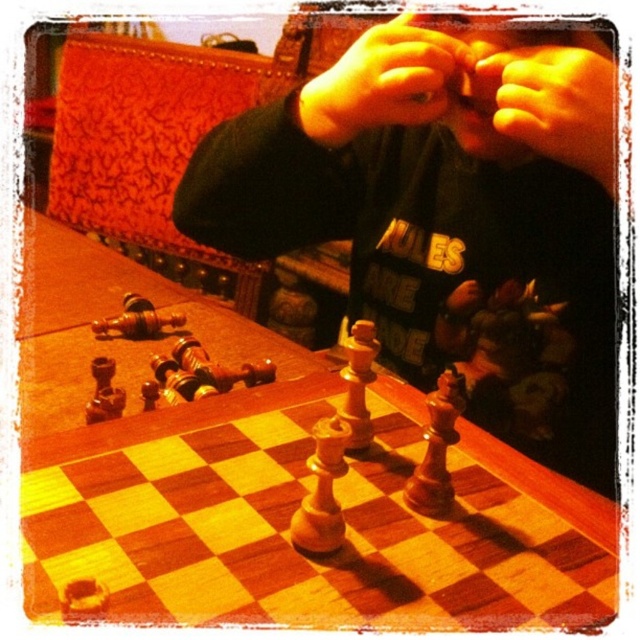
Question: Does wooden chessboard at center have a smaller size compared to smooth skin hand at upper center?

Choices:
 (A) yes
 (B) no

Answer: (B)

Question: Where is wooden chess pieces at center located in relation to smooth skin hand at upper center in the image?

Choices:
 (A) above
 (B) below

Answer: (B)

Question: Which point appears farthest from the camera in this image?

Choices:
 (A) (122, 365)
 (B) (566, 88)
 (C) (490, 80)
 (D) (356, 99)

Answer: (A)

Question: Which point is farther to the camera?

Choices:
 (A) (321, 113)
 (B) (492, 125)
 (C) (268, 140)
 (D) (202, 326)

Answer: (D)

Question: Which object is positioned closest to the wooden chess pieces at center?

Choices:
 (A) yellowish skin at center
 (B) smooth skin hand at upper center
 (C) wooden chessboard at center

Answer: (A)

Question: Is wooden chess pieces at center thinner than smooth skin hand at upper center?

Choices:
 (A) no
 (B) yes

Answer: (A)